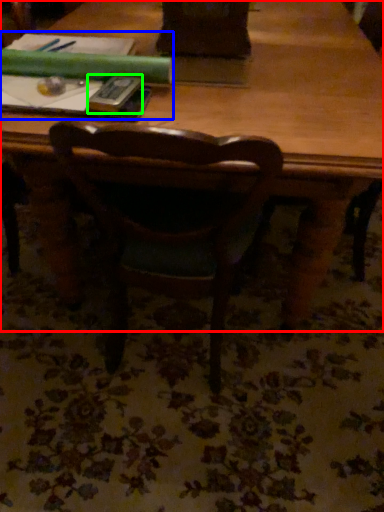
Question: Which is nearer to the table (highlighted by a red box)? book (highlighted by a blue box) or paperback book (highlighted by a green box).

Choices:
 (A) book
 (B) paperback book

Answer: (A)